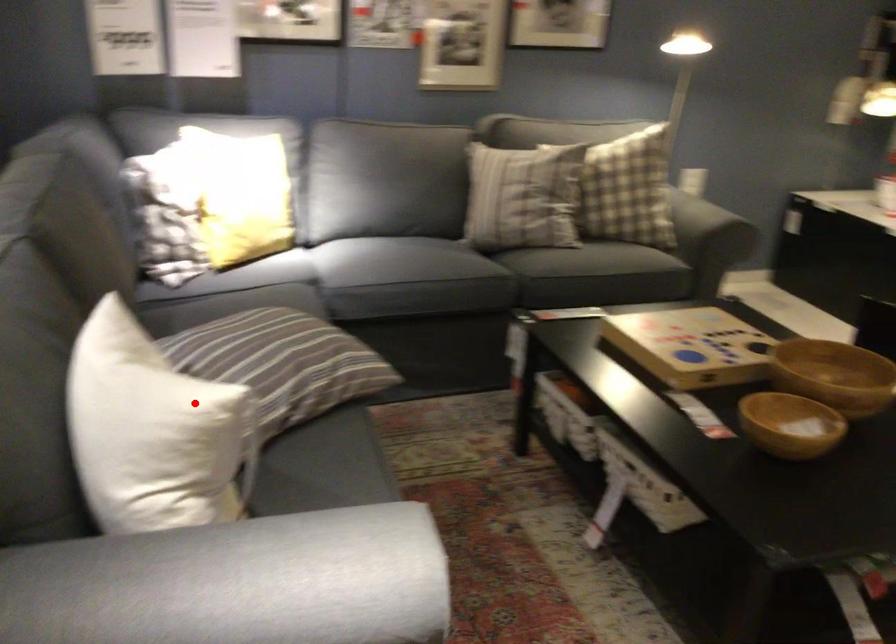
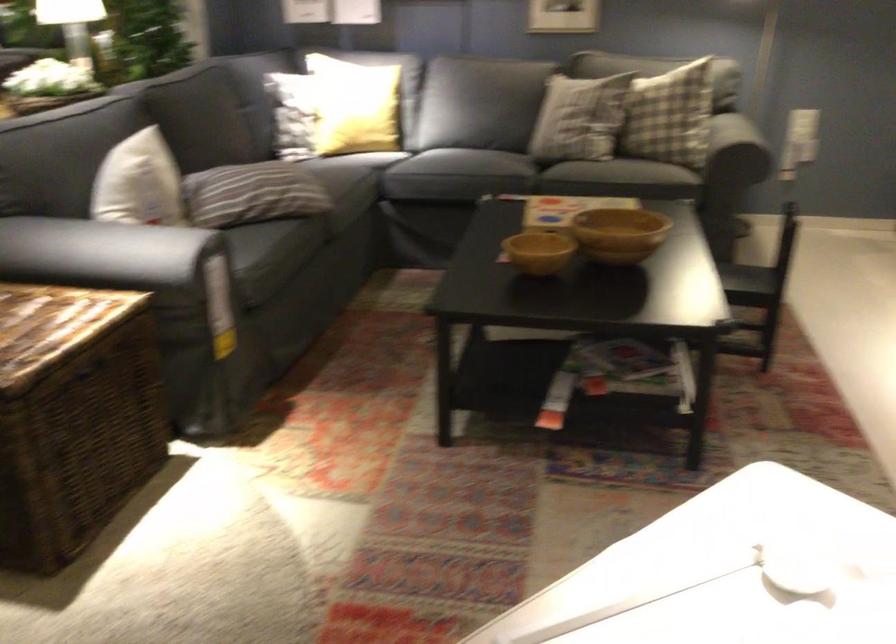
Question: A red point is marked in image1. In image2, is the corresponding 3D point closer to the camera or farther? Reply with the corresponding letter.

Choices:
 (A) The corresponding 3D point is closer.
 (B) The corresponding 3D point is farther.

Answer: (B)